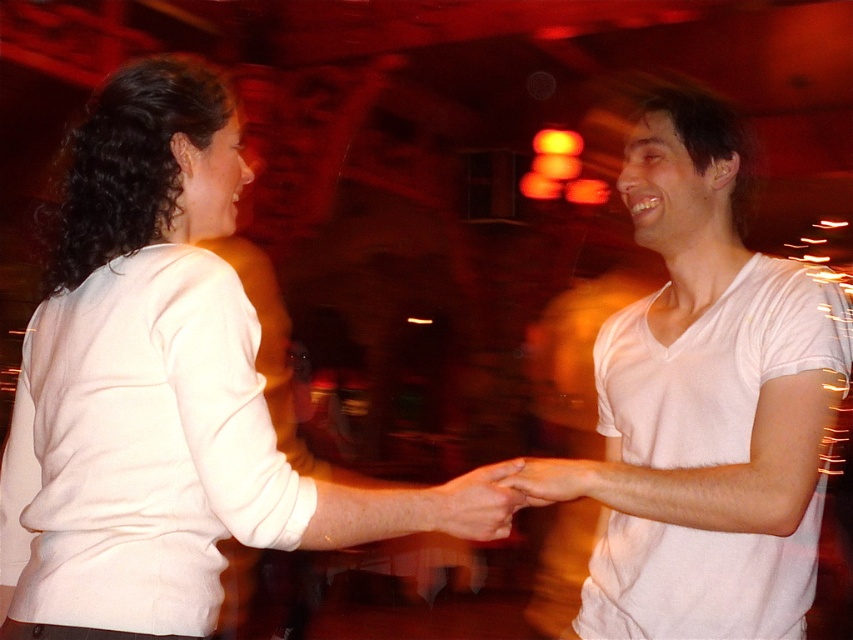
You are a photographer standing in front of the scene. You want to take a closeup photo of the matte white hand at center. The camera you are using has a minimum focusing distance of 4 feet. Can you take the photo without moving closer?

The matte white hand at center is 3.92 feet from camera. Since the minimum focusing distance is 4 feet, the camera cannot focus on the hand because it is closer than the required distance. You need to move back or use a different camera with a shorter minimum focusing distance.

You are a photographer trying to capture the two points in the image. Which point, point (x=97, y=179) or point (x=511, y=472), would appear larger in your photo?

Point (x=97, y=179) is closer to the camera than point (x=511, y=472), so it would appear larger in the photo.

You are a photographer trying to capture the interaction between the two people in the image. You want to ensure that both matte white hand at center and smooth skin hand at center are clearly visible in your shot. Based on their positions, which hand should you focus on first to ensure both are in frame?

The matte white hand at center is positioned on the left side of smooth skin hand at center. To ensure both are in frame, focus on the matte white hand at center first as it is on the left, then adjust to include the smooth skin hand at center on the right.